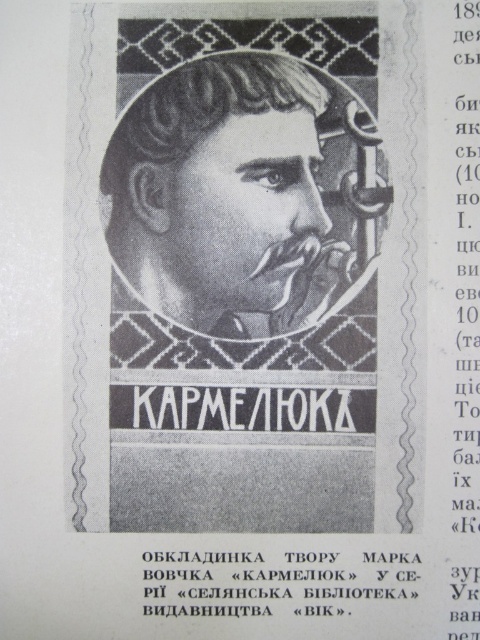
Question: Which of the following is the farthest from the observer?

Choices:
 (A) (331, 282)
 (B) (411, 593)
 (C) (474, 294)

Answer: (A)

Question: Observing the image, what is the correct spatial positioning of gray pencil sketch of man at center in reference to white textured text at center?

Choices:
 (A) left
 (B) right

Answer: (A)

Question: Does black paper text at upper center appear on the right side of black paper text at center?

Choices:
 (A) yes
 (B) no

Answer: (A)

Question: Does gray pencil sketch of man at center appear on the left side of white textured text at center?

Choices:
 (A) yes
 (B) no

Answer: (A)

Question: Which object appears farthest from the camera in this image?

Choices:
 (A) white textured text at center
 (B) black paper text at center
 (C) black paper text at upper center
 (D) gray pencil sketch of man at center

Answer: (A)

Question: Which of the following is the farthest from the observer?

Choices:
 (A) gray pencil sketch of man at center
 (B) black paper text at upper center
 (C) white textured text at center
 (D) black paper text at center

Answer: (C)